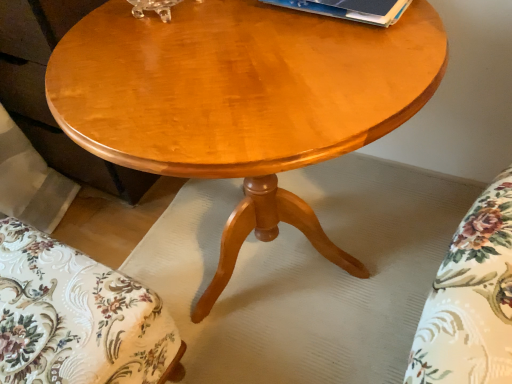
Identify the location of vacant space situated above floral fabric cushion at lower left (from a real-world perspective). (36, 318).